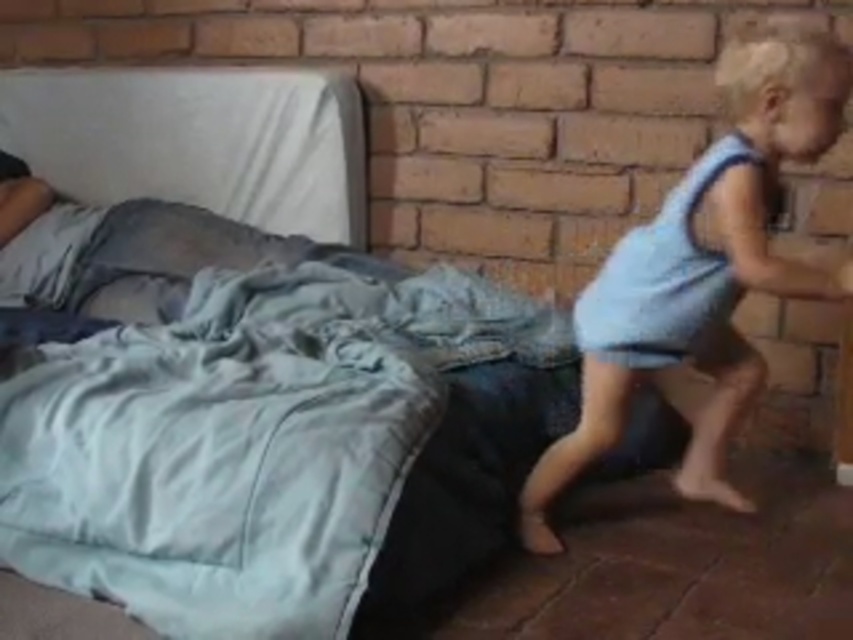
Question: Which point is closer to the camera?

Choices:
 (A) (761, 244)
 (B) (216, 452)

Answer: (B)

Question: Can you confirm if silky blue blanket at center is positioned to the left of light blue fabric at right?

Choices:
 (A) yes
 (B) no

Answer: (A)

Question: Considering the relative positions of silky blue blanket at center and light blue fabric at right in the image provided, where is silky blue blanket at center located with respect to light blue fabric at right?

Choices:
 (A) left
 (B) right

Answer: (A)

Question: Is silky blue blanket at center bigger than light blue fabric at right?

Choices:
 (A) no
 (B) yes

Answer: (B)

Question: Among these points, which one is farthest from the camera?

Choices:
 (A) (660, 301)
 (B) (230, 541)

Answer: (A)